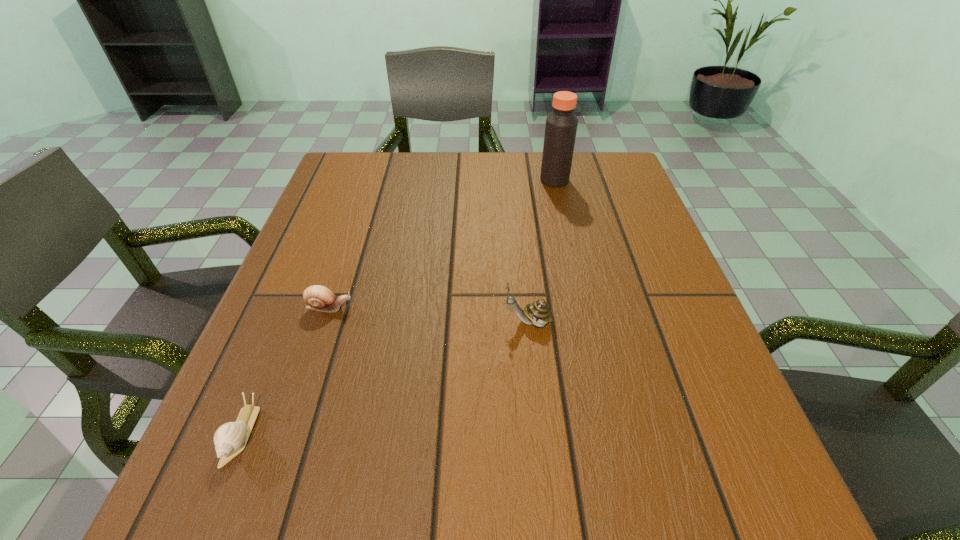
Image resolution: width=960 pixels, height=540 pixels. Identify the location of vacant point that satisfies the following two spatial constraints: 1. on the face of the second tallest object; 2. on the shell of the nearest object. (540, 434).

This screenshot has width=960, height=540. Find the location of `free space that satisfies the following two spatial constraints: 1. on the front-facing side of the second object from left to right; 2. on the shell of the nearest object`. free space that satisfies the following two spatial constraints: 1. on the front-facing side of the second object from left to right; 2. on the shell of the nearest object is located at coordinates (288, 434).

Locate an element on the screen. Image resolution: width=960 pixels, height=540 pixels. free spot that satisfies the following two spatial constraints: 1. on the face of the third shortest object; 2. on the shell of the shortest object is located at coordinates (540, 434).